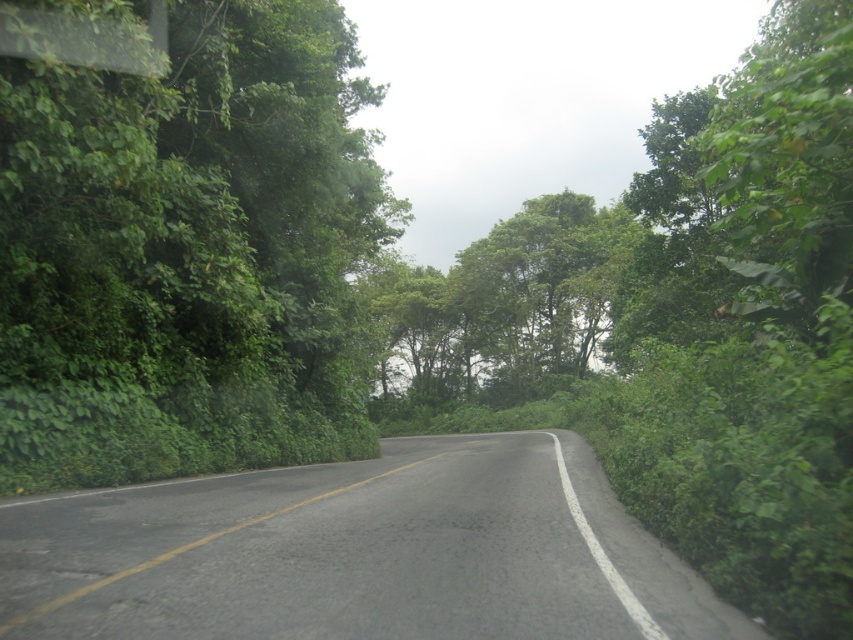
Who is taller, green leafy tree at left or green leafy tree at center?

Standing taller between the two is green leafy tree at center.

Between point (103, 227) and point (494, 348), which one is positioned behind?

Point (494, 348)

Based on the photo, who is more distant from viewer, (109, 227) or (479, 312)?

The point (479, 312) is behind.

The width and height of the screenshot is (853, 640). I want to click on green leafy tree at left, so [x=187, y=252].

Which is more to the left, green leafy tree at left or black asphalt road at center?

Positioned to the left is green leafy tree at left.

Is green leafy tree at left closer to camera compared to black asphalt road at center?

No, it is not.

Measure the distance between green leafy tree at left and camera.

green leafy tree at left and camera are 10.69 meters apart.

This screenshot has width=853, height=640. I want to click on green leafy tree at left, so click(x=187, y=252).

Consider the image. Does black asphalt road at center appear on the left side of green leafy tree at center?

Indeed, black asphalt road at center is positioned on the left side of green leafy tree at center.

Can you confirm if black asphalt road at center is taller than green leafy tree at center?

No.

Is point (625, 596) less distant than point (509, 275)?

Yes.

Where is `black asphalt road at center`? This screenshot has height=640, width=853. black asphalt road at center is located at coordinates (358, 554).